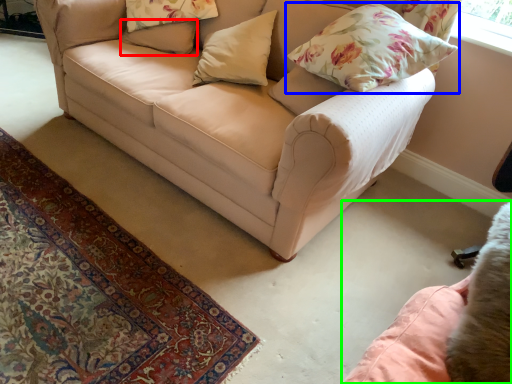
Question: Which object is the farthest from pillow (highlighted by a red box)? Choose among these: pillow (highlighted by a blue box) or swivel chair (highlighted by a green box).

Choices:
 (A) pillow
 (B) swivel chair

Answer: (B)